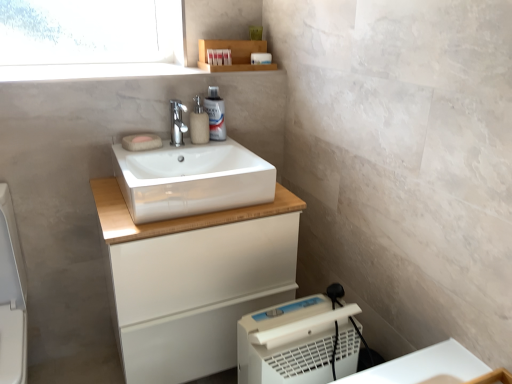
Question: Is white plastic container at upper center, the 4th toiletry when ordered from bottom to top, next to matte plastic container at upper center, which is the third toiletry in top-to-bottom order, and touching it?

Choices:
 (A) yes
 (B) no

Answer: (A)

Question: Is the position of white plastic container at upper center, the 4th toiletry when ordered from bottom to top, less distant than that of matte plastic container at upper center, the second toiletry in the bottom-to-top sequence?

Choices:
 (A) no
 (B) yes

Answer: (A)

Question: From the image's perspective, is white plastic container at upper center, which appears as the 1th toiletry when viewed from the top, on top of matte plastic container at upper center, the second toiletry in the bottom-to-top sequence?

Choices:
 (A) yes
 (B) no

Answer: (A)

Question: Is white plastic container at upper center, the 4th toiletry when ordered from bottom to top, at the left side of matte plastic container at upper center, which is the third toiletry in top-to-bottom order?

Choices:
 (A) yes
 (B) no

Answer: (B)

Question: Is white plastic container at upper center, which appears as the 1th toiletry when viewed from the top, oriented away from matte plastic container at upper center, the second toiletry in the bottom-to-top sequence?

Choices:
 (A) yes
 (B) no

Answer: (B)

Question: In terms of width, does matte plastic container at upper center, which appears as the 2th toiletry when viewed from the top, look wider or thinner when compared to white glossy sink at center?

Choices:
 (A) thin
 (B) wide

Answer: (A)

Question: Considering the positions of matte plastic container at upper center, marked as the 3th toiletry in a bottom-to-top arrangement, and white glossy sink at center in the image, is matte plastic container at upper center, marked as the 3th toiletry in a bottom-to-top arrangement, taller or shorter than white glossy sink at center?

Choices:
 (A) short
 (B) tall

Answer: (A)

Question: Is matte plastic container at upper center, which appears as the 2th toiletry when viewed from the top, in front of or behind white glossy sink at center in the image?

Choices:
 (A) behind
 (B) front

Answer: (A)

Question: Based on their sizes in the image, would you say matte plastic container at upper center, which appears as the 2th toiletry when viewed from the top, is bigger or smaller than white glossy sink at center?

Choices:
 (A) big
 (B) small

Answer: (B)

Question: In terms of height, does polished chrome faucet at center look taller or shorter compared to white matte cabinet at center?

Choices:
 (A) short
 (B) tall

Answer: (A)

Question: Considering the relative positions of polished chrome faucet at center and white matte cabinet at center in the image provided, is polished chrome faucet at center to the left or to the right of white matte cabinet at center?

Choices:
 (A) left
 (B) right

Answer: (A)

Question: Is polished chrome faucet at center inside the boundaries of white matte cabinet at center, or outside?

Choices:
 (A) inside
 (B) outside

Answer: (B)

Question: Is point click(177, 109) closer or farther from the camera than point click(188, 256)?

Choices:
 (A) closer
 (B) farther

Answer: (B)

Question: Is beige fabric soap at upper center, which is the first soap from front to back, to the left or to the right of matte beige soap at center, the first soap positioned from the back, in the image?

Choices:
 (A) left
 (B) right

Answer: (B)

Question: From the image's perspective, is beige fabric soap at upper center, which is the first soap from front to back, positioned above or below matte beige soap at center, which is the second soap from front to back?

Choices:
 (A) above
 (B) below

Answer: (B)